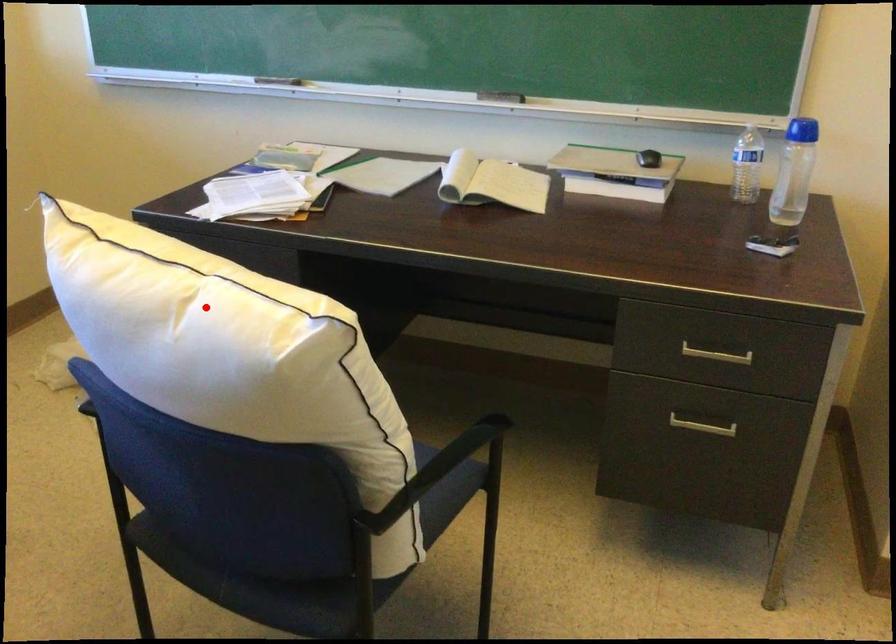
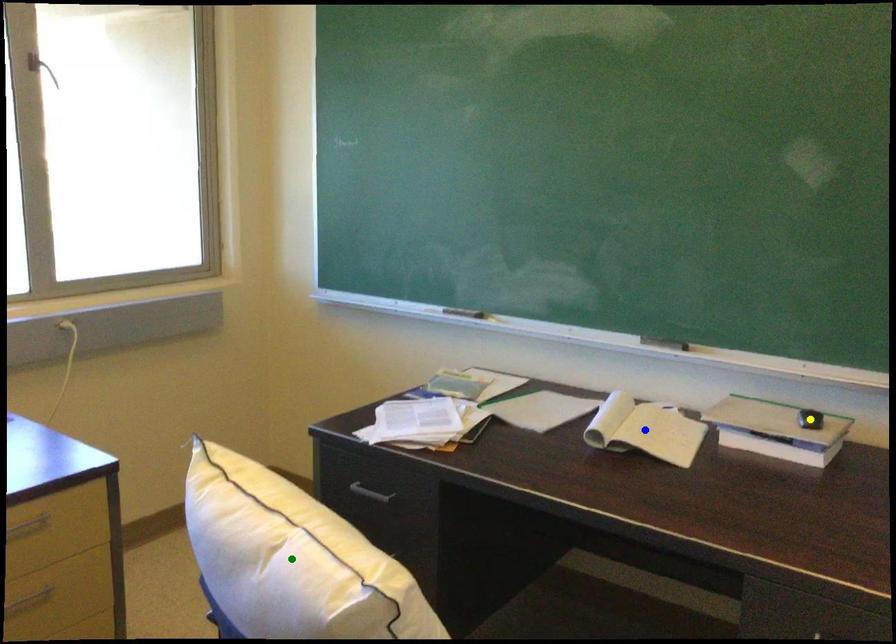
Question: I am providing you with two images of the same scene from different viewpoints. A red point is marked on the first image. You are given multiple points on the second image. Can you choose the point in image 2 that corresponds to the point in image 1?

Choices:
 (A) yellow point
 (B) blue point
 (C) green point

Answer: (C)